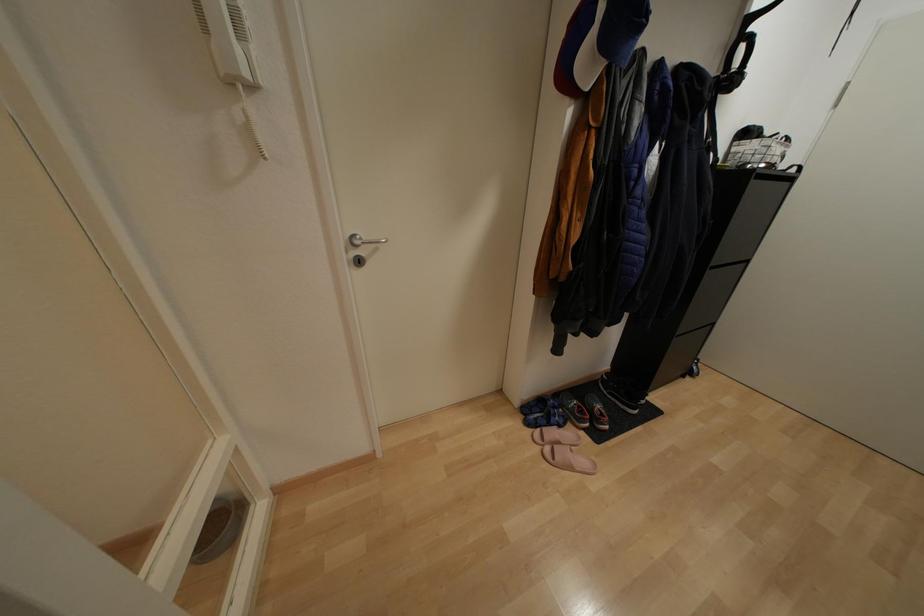
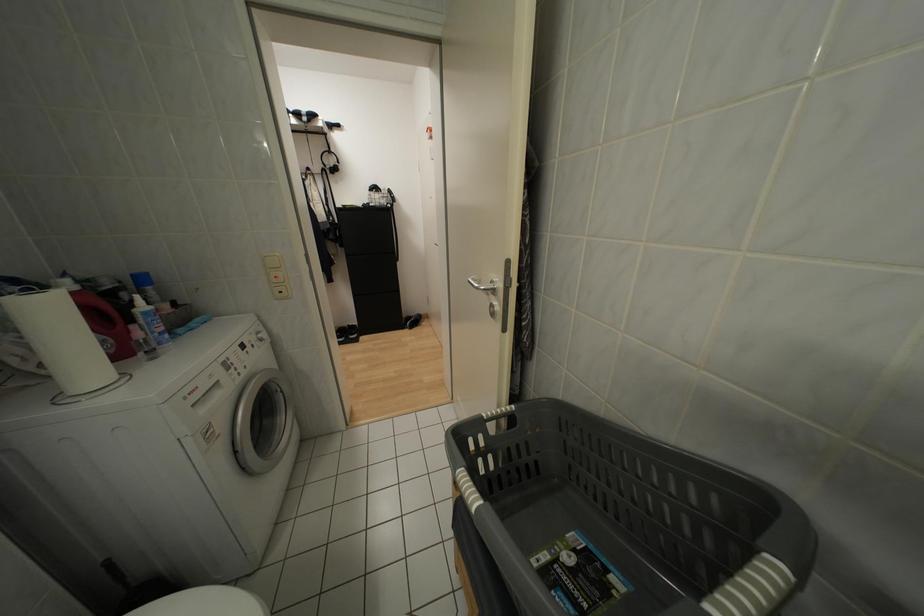
Which direction would the cameraman need to move to produce the second image?

The cameraman moved toward right, backward.